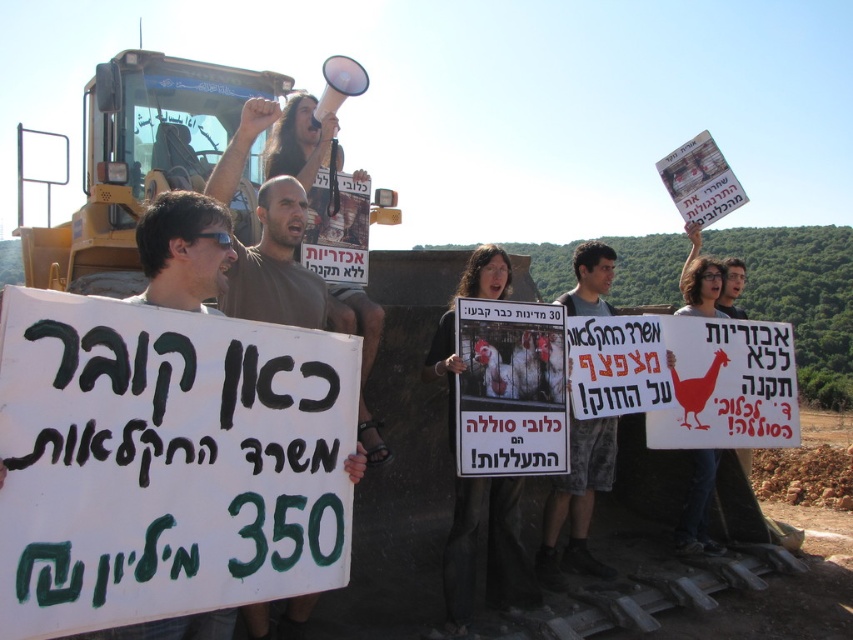
Which object is taller between the black fabric shirt at center and the white paper sign at upper right?

The black fabric shirt at center is taller than the white paper sign at upper right.

You are a photographer trying to capture the protest scene. You notice two points marked in the image. Which point is closer to you, point 1 at (589, 456) or point 2 at (718, 296)?

Point 1 at (589, 456) is closer to the viewer than point 2 at (718, 296).

Based on the photo, what is located at the coordinates point (486, 554)?

The black fabric shirt at center is located at point (486, 554).